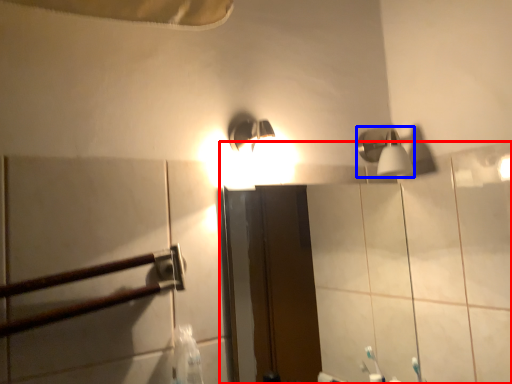
Question: Which object appears farthest to the camera in this image, mirror (highlighted by a red box) or shower (highlighted by a blue box)?

Choices:
 (A) mirror
 (B) shower

Answer: (B)